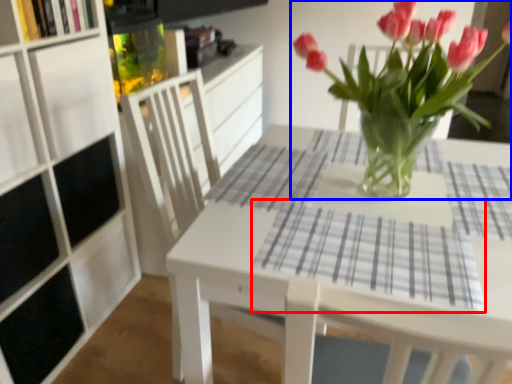
Question: Which object appears farthest to the camera in this image, flannel (highlighted by a red box) or houseplant (highlighted by a blue box)?

Choices:
 (A) flannel
 (B) houseplant

Answer: (A)